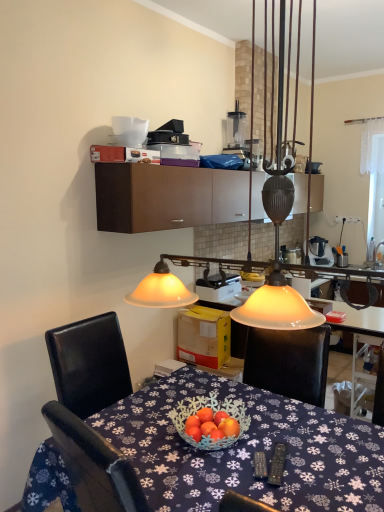
Identify the location of brown matte cabinet at upper center. (167, 197).

The height and width of the screenshot is (512, 384). What do you see at coordinates (320, 251) in the screenshot?
I see `white plastic blender at upper center, positioned as the 2th appliance in bottom-to-top order` at bounding box center [320, 251].

Image resolution: width=384 pixels, height=512 pixels. Describe the element at coordinates (246, 450) in the screenshot. I see `blue fabric tablecloth at center` at that location.

Find the location of `matte glass lampshade at upper center`. matte glass lampshade at upper center is located at coordinates (278, 244).

What do you see at coordinates (278, 244) in the screenshot? This screenshot has height=512, width=384. I see `matte glass lampshade at upper center` at bounding box center [278, 244].

The height and width of the screenshot is (512, 384). In order to click on brown matte cabinet at upper center in this screenshot , I will do `click(167, 197)`.

Consider the image. From the image's perspective, is white plastic toaster at center, placed as the 2th appliance when sorted from back to front, located above or below brown matte cabinet at upper center?

Clearly, from the image's perspective, white plastic toaster at center, placed as the 2th appliance when sorted from back to front, is below brown matte cabinet at upper center.

From a real-world perspective, is white plastic toaster at center, which appears as the 2th appliance when viewed from the right, physically located above or below brown matte cabinet at upper center?

In terms of real-world spatial position, white plastic toaster at center, which appears as the 2th appliance when viewed from the right, is below brown matte cabinet at upper center.

Can you tell me how much white plastic toaster at center, which appears as the 2th appliance when viewed from the right, and brown matte cabinet at upper center differ in facing direction?

90 degrees.

Where is `appliance that is the 1st object located behind the brown matte cabinet at upper center`? The width and height of the screenshot is (384, 512). appliance that is the 1st object located behind the brown matte cabinet at upper center is located at coordinates coord(218,286).

From a real-world perspective, who is located lower, white plastic toaster at center, acting as the second appliance starting from the top, or white plastic blender at upper center, which appears as the 1th appliance when viewed from the back?

In real-world perspective, white plastic toaster at center, acting as the second appliance starting from the top, is lower.

Considering the positions of objects white plastic toaster at center, acting as the second appliance starting from the top, and white plastic blender at upper center, which appears as the second appliance when viewed from the left, in the image provided, who is more to the left, white plastic toaster at center, acting as the second appliance starting from the top, or white plastic blender at upper center, which appears as the second appliance when viewed from the left,?

Positioned to the left is white plastic toaster at center, acting as the second appliance starting from the top.

Is point (229, 295) behind point (329, 257)?

No, (229, 295) is closer to viewer.

Is white plastic toaster at center, acting as the second appliance starting from the top, facing towards white plastic blender at upper center, which appears as the second appliance when viewed from the left?

No, white plastic toaster at center, acting as the second appliance starting from the top, is not turned towards white plastic blender at upper center, which appears as the second appliance when viewed from the left.

The width and height of the screenshot is (384, 512). Find the location of `desk in front of the white plastic toaster at center, the first appliance when ordered from left to right`. desk in front of the white plastic toaster at center, the first appliance when ordered from left to right is located at coordinates (246, 450).

How much distance is there between white plastic toaster at center, the first appliance from the front, and blue fabric tablecloth at center?

white plastic toaster at center, the first appliance from the front, is 25.30 inches away from blue fabric tablecloth at center.

Is white plastic toaster at center, acting as the second appliance starting from the top, facing towards blue fabric tablecloth at center?

No, white plastic toaster at center, acting as the second appliance starting from the top, is not aimed at blue fabric tablecloth at center.

Is matte glass lampshade at upper center beside white plastic toaster at center, acting as the second appliance starting from the top?

No, matte glass lampshade at upper center is not touching white plastic toaster at center, acting as the second appliance starting from the top.

From the image's perspective, which is above, matte glass lampshade at upper center or white plastic toaster at center, which appears as the first appliance when ordered from the bottom?

matte glass lampshade at upper center.

Between matte glass lampshade at upper center and white plastic toaster at center, which appears as the 2th appliance when viewed from the right, which one is positioned behind?

white plastic toaster at center, which appears as the 2th appliance when viewed from the right, is behind.

This screenshot has height=512, width=384. In order to click on cabinetry that is above the blue fabric tablecloth at center (from the image's perspective) in this screenshot , I will do `click(167, 197)`.

From a real-world perspective, does blue fabric tablecloth at center stand above brown matte cabinet at upper center?

No.

Is brown matte cabinet at upper center inside blue fabric tablecloth at center?

No, brown matte cabinet at upper center is not a part of blue fabric tablecloth at center.

Can you confirm if blue fabric tablecloth at center is thinner than brown matte cabinet at upper center?

Yes, blue fabric tablecloth at center is thinner than brown matte cabinet at upper center.

This screenshot has height=512, width=384. I want to click on cabinetry that appears below the matte glass lampshade at upper center (from a real-world perspective), so click(167, 197).

Looking at this image, does brown matte cabinet at upper center come in front of matte glass lampshade at upper center?

No, the depth of brown matte cabinet at upper center is greater than that of matte glass lampshade at upper center.

Looking at their sizes, would you say brown matte cabinet at upper center is wider or thinner than matte glass lampshade at upper center?

brown matte cabinet at upper center is wider than matte glass lampshade at upper center.

Which is closer, (227, 170) or (248, 312)?

Clearly, point (227, 170) is more distant from the camera than point (248, 312).

From the picture: Could you tell me if matte glass lampshade at upper center is facing brown matte cabinet at upper center?

No, matte glass lampshade at upper center is not turned towards brown matte cabinet at upper center.

Is matte glass lampshade at upper center spatially inside brown matte cabinet at upper center, or outside of it?

matte glass lampshade at upper center is located beyond the bounds of brown matte cabinet at upper center.

Is matte glass lampshade at upper center placed right next to brown matte cabinet at upper center?

No.

From a real-world perspective, is matte glass lampshade at upper center located higher than brown matte cabinet at upper center?

Yes.

At what (x,y) coordinates should I click in order to perform the action: click on the 2nd appliance directly beneath the brown matte cabinet at upper center (from a real-world perspective). Please return your answer as a coordinate pair (x, y). Looking at the image, I should click on (218, 286).

At what (x,y) coordinates should I click in order to perform the action: click on appliance located above the white plastic toaster at center, which appears as the first appliance when ordered from the bottom (from a real-world perspective). Please return your answer as a coordinate pair (x, y). This screenshot has width=384, height=512. Looking at the image, I should click on (320, 251).

Based on their spatial positions, is matte glass lampshade at upper center or brown matte cabinet at upper center further from blue fabric tablecloth at center?

brown matte cabinet at upper center is further to blue fabric tablecloth at center.

Estimate the real-world distances between objects in this image. Which object is closer to brown matte cabinet at upper center, blue fabric tablecloth at center or matte glass lampshade at upper center?

matte glass lampshade at upper center is positioned closer to the anchor brown matte cabinet at upper center.

Looking at the image, which one is located closer to white plastic toaster at center, acting as the second appliance starting from the top, matte glass lampshade at upper center or brown matte cabinet at upper center?

matte glass lampshade at upper center lies closer to white plastic toaster at center, acting as the second appliance starting from the top, than the other object.

Based on their spatial positions, is white plastic blender at upper center, positioned as the 2th appliance in bottom-to-top order, or white plastic toaster at center, placed as the 2th appliance when sorted from back to front, closer to matte glass lampshade at upper center?

white plastic toaster at center, placed as the 2th appliance when sorted from back to front, is positioned closer to the anchor matte glass lampshade at upper center.

Considering their positions, is white plastic blender at upper center, the 1th appliance viewed from the top, positioned further to white plastic toaster at center, the first appliance when ordered from left to right, than blue fabric tablecloth at center?

Based on the image, white plastic blender at upper center, the 1th appliance viewed from the top, appears to be further to white plastic toaster at center, the first appliance when ordered from left to right.

Considering their positions, is white plastic blender at upper center, which appears as the second appliance when viewed from the front, positioned closer to brown matte cabinet at upper center than blue fabric tablecloth at center?

blue fabric tablecloth at center.

From the image, which object appears to be nearer to brown matte cabinet at upper center, matte glass lampshade at upper center or white plastic toaster at center, placed as the 2th appliance when sorted from back to front?

white plastic toaster at center, placed as the 2th appliance when sorted from back to front, is closer to brown matte cabinet at upper center.

Considering their positions, is white plastic toaster at center, which appears as the first appliance when ordered from the bottom, positioned closer to blue fabric tablecloth at center than brown matte cabinet at upper center?

white plastic toaster at center, which appears as the first appliance when ordered from the bottom, is positioned closer to the anchor blue fabric tablecloth at center.

Locate an element on the screen. The width and height of the screenshot is (384, 512). appliance positioned between brown matte cabinet at upper center and white plastic blender at upper center, which appears as the second appliance when viewed from the front, from near to far is located at coordinates (218, 286).

The image size is (384, 512). Identify the location of lamp between blue fabric tablecloth at center and white plastic toaster at center, acting as the second appliance starting from the top, in the front-back direction. (278, 244).

Identify the location of cabinetry located between blue fabric tablecloth at center and white plastic blender at upper center, which appears as the second appliance when viewed from the front, in the depth direction. The width and height of the screenshot is (384, 512). (167, 197).

Identify the location of lamp between blue fabric tablecloth at center and brown matte cabinet at upper center in the front-back direction. The width and height of the screenshot is (384, 512). (278, 244).